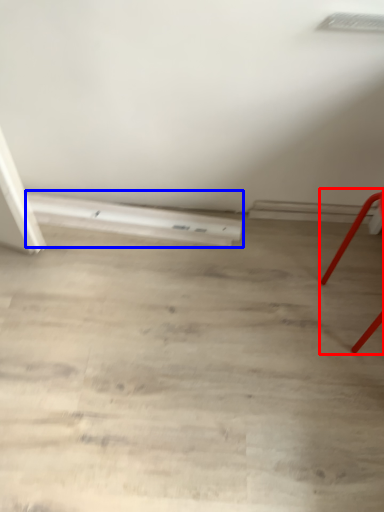
Question: Which of the following is the closest to the observer, furniture (highlighted by a red box) or plank (highlighted by a blue box)?

Choices:
 (A) furniture
 (B) plank

Answer: (A)